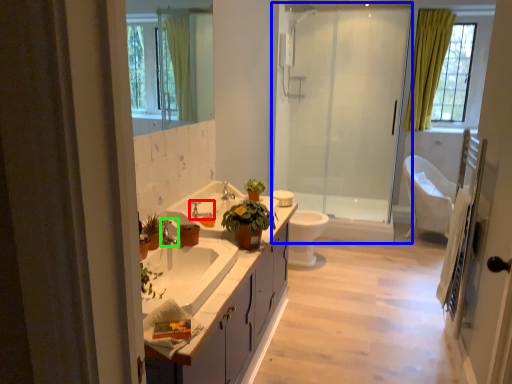
Question: Based on their relative distances, which object is farther from tap (highlighted by a red box)? Choose from shower door (highlighted by a blue box) and faucet (highlighted by a green box).

Choices:
 (A) shower door
 (B) faucet

Answer: (A)